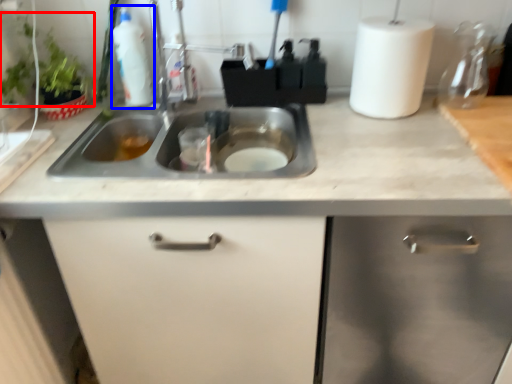
Question: Which object is closer to the camera taking this photo, plant (highlighted by a red box) or cleaning product (highlighted by a blue box)?

Choices:
 (A) plant
 (B) cleaning product

Answer: (A)